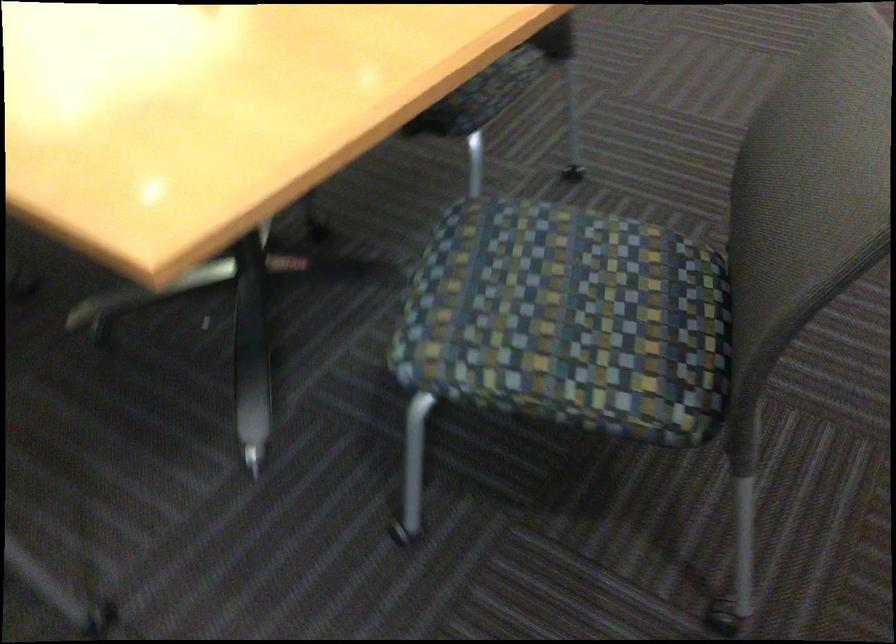
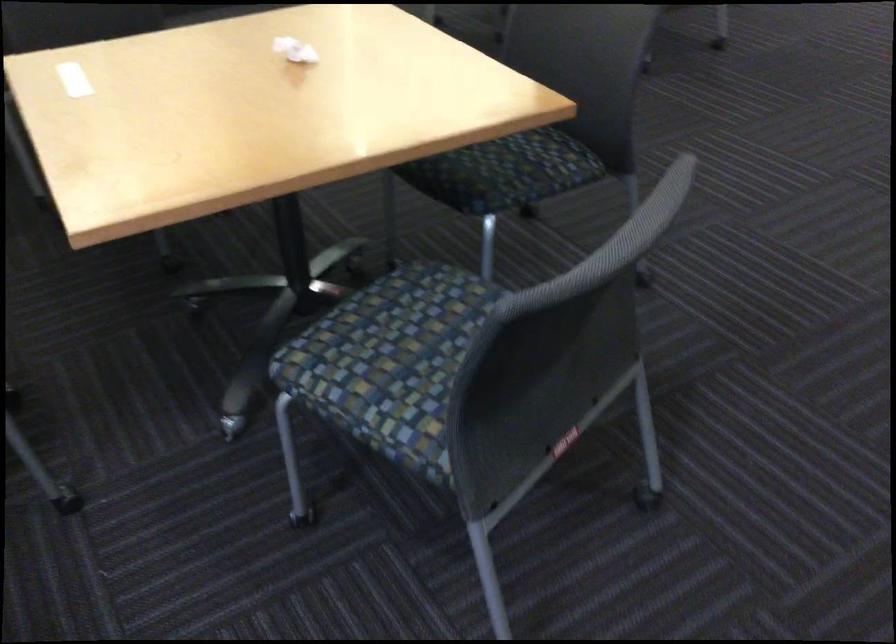
Find the pixel in the second image that matches [544,319] in the first image.

(391, 361)